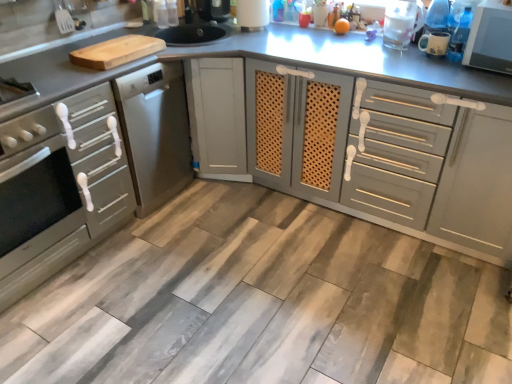
You are a GUI agent. You are given a task and a screenshot of the screen. Output one action in this format:
    pyautogui.click(x=<x>, y=<y>)
    Task: Click on the empty space that is ontop of matte gray oven at left, which appears as the second cabinetry when viewed from the right (from a real-world perspective)
    This screenshot has width=512, height=384.
    Given the screenshot: What is the action you would take?
    pyautogui.click(x=34, y=67)